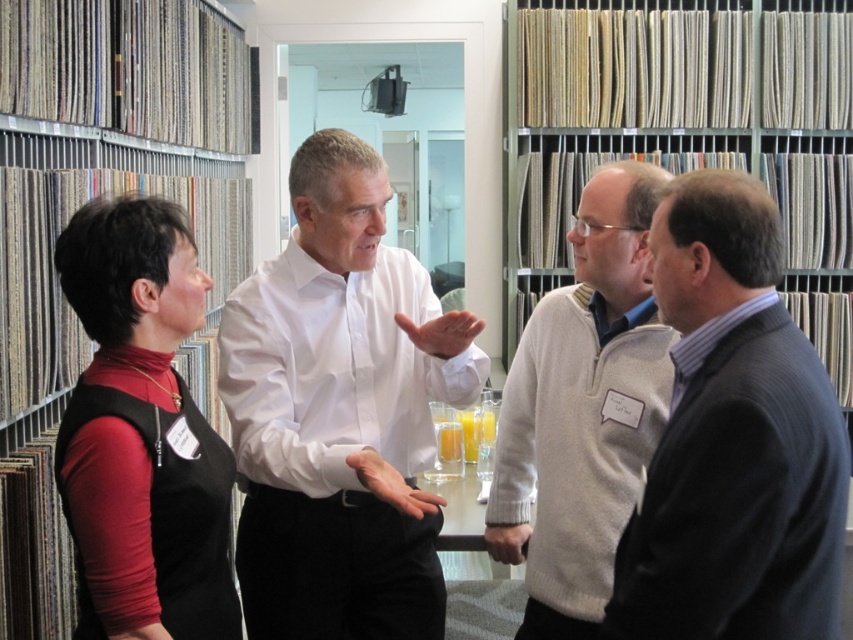
You are standing in the showroom and need to hand a fabric sample to the person wearing the white smooth shirt at center. If you are currently 2 meters away from them, can you reach them without moving closer? Please explain your reasoning.

The white smooth shirt at center and the viewer are 1.59 meters apart. Since you are currently 2 meters away, which is farther than the 1.59 meters required, you would need to move closer to reach them. Alternatively, they might need to move towards you to shorten the distance.

You are a new employee in the showroom and need to locate the white smooth shirt at center and the metallic gray bookshelf at left. Based on the scene description, can you determine the relative positions of these two objects?

The white smooth shirt at center is below the metallic gray bookshelf at left, so the metallic gray bookshelf at left is positioned above the white smooth shirt at center.